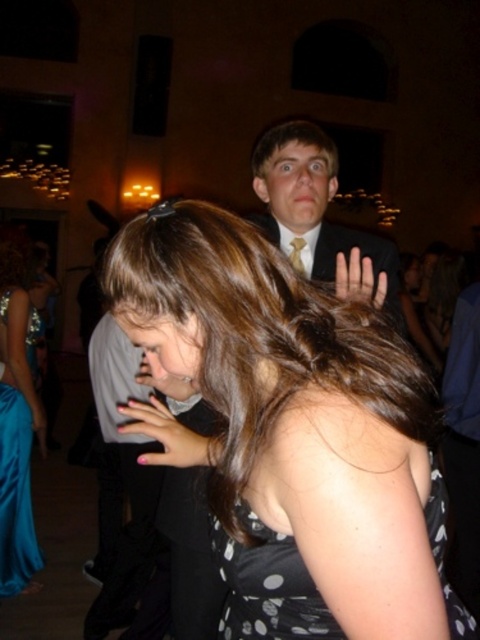
Question: Considering the real-world distances, which object is farthest from the black dotted fabric dress at center?

Choices:
 (A) matte black hand at lower center
 (B) dark brown hair at upper center

Answer: (B)

Question: Is dark brown hair at upper center above matte black hand at lower center?

Choices:
 (A) yes
 (B) no

Answer: (A)

Question: Can you confirm if black dotted dress at center is positioned to the left of matte black suit at upper center?

Choices:
 (A) yes
 (B) no

Answer: (A)

Question: Among these objects, which one is nearest to the camera?

Choices:
 (A) matte black suit at upper center
 (B) dark brown hair at upper center
 (C) pink nail polish at center
 (D) matte skin hand at upper center

Answer: (C)

Question: Which point appears farthest from the camera in this image?

Choices:
 (A) (216, 560)
 (B) (19, 259)
 (C) (402, 620)

Answer: (B)

Question: Observing the image, what is the correct spatial positioning of matte black suit at upper center in reference to dark brown hair at upper center?

Choices:
 (A) below
 (B) above

Answer: (A)